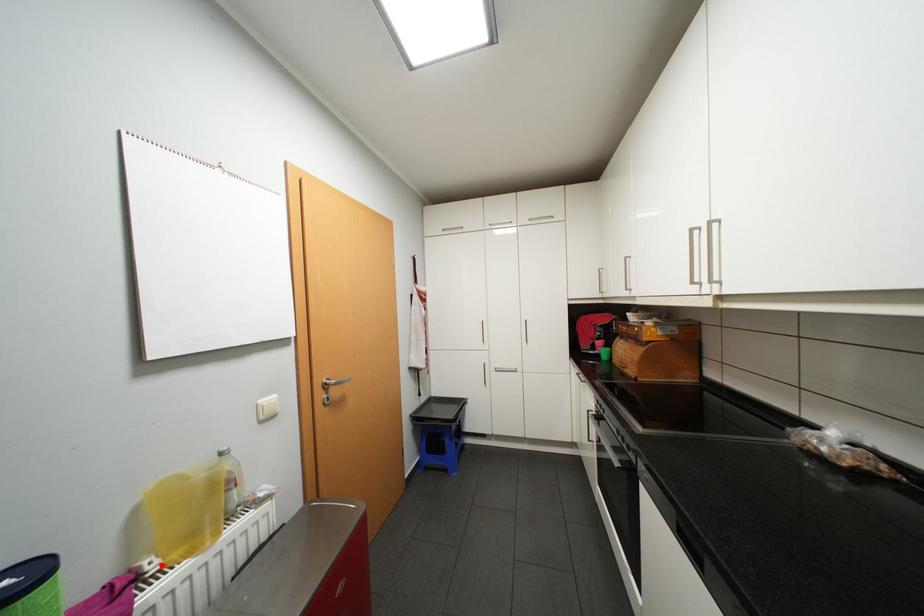
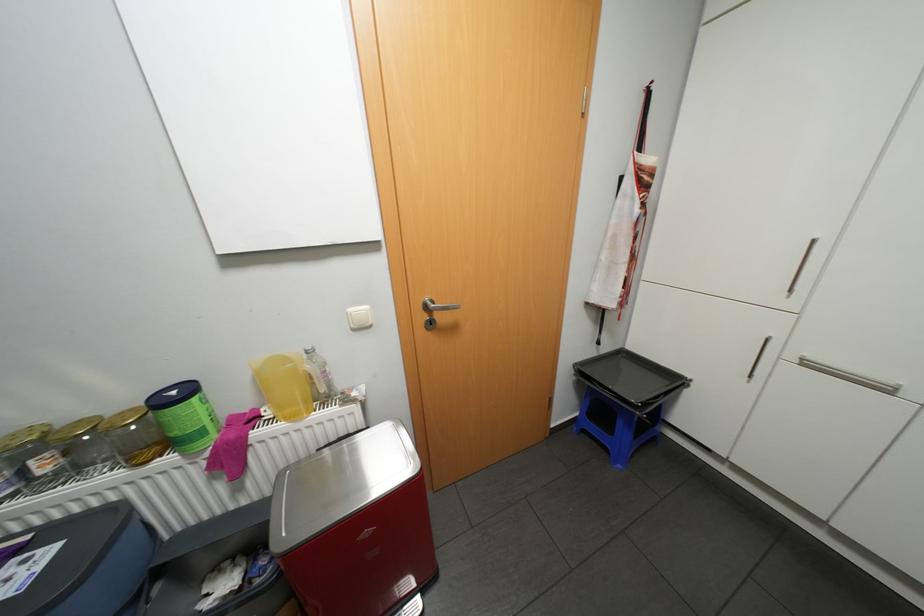
Find the pixel in the second image that matches the highlighted location in the first image.

(275, 413)